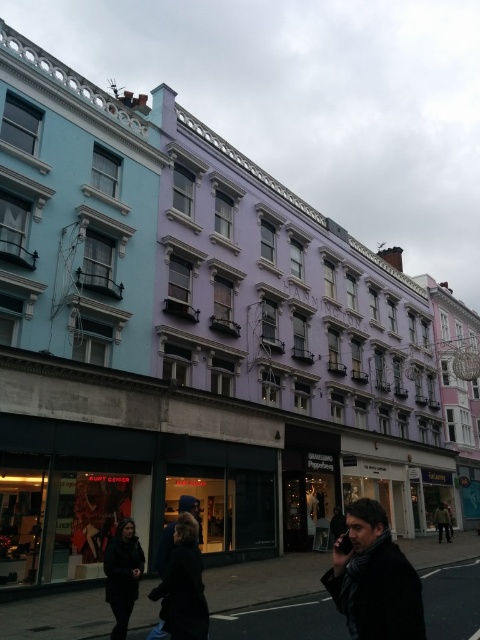
Measure the distance between dark gray wool scarf at lower right and camera.

dark gray wool scarf at lower right and camera are 23.80 feet apart.

Where is `dark gray wool scarf at lower right`? This screenshot has width=480, height=640. dark gray wool scarf at lower right is located at coordinates (374, 579).

The height and width of the screenshot is (640, 480). What are the coordinates of `dark gray wool scarf at lower right` in the screenshot? It's located at point(374,579).

From the picture: Which is above, dark gray wool scarf at lower right or dark blue jacket at lower center?

Positioned higher is dark blue jacket at lower center.

Is dark gray wool scarf at lower right to the left of dark blue jacket at lower center from the viewer's perspective?

Incorrect, dark gray wool scarf at lower right is not on the left side of dark blue jacket at lower center.

Which is behind, point (386, 572) or point (136, 547)?

The point (136, 547) is behind.

You are a GUI agent. You are given a task and a screenshot of the screen. Output one action in this format:
    pyautogui.click(x=<x>, y=<y>)
    Task: Click on the dark gray wool scarf at lower right
    The height and width of the screenshot is (640, 480).
    Given the screenshot: What is the action you would take?
    pyautogui.click(x=374, y=579)

Looking at this image, can you confirm if dark blue jacket at lower center is thinner than dark gray scarf at center?

Yes.

Which is more to the right, dark blue jacket at lower center or dark gray scarf at center?

dark gray scarf at center

Does point (120, 628) come in front of point (439, 502)?

Yes, it is in front of point (439, 502).

The width and height of the screenshot is (480, 640). In order to click on dark blue jacket at lower center in this screenshot , I will do click(122, 573).